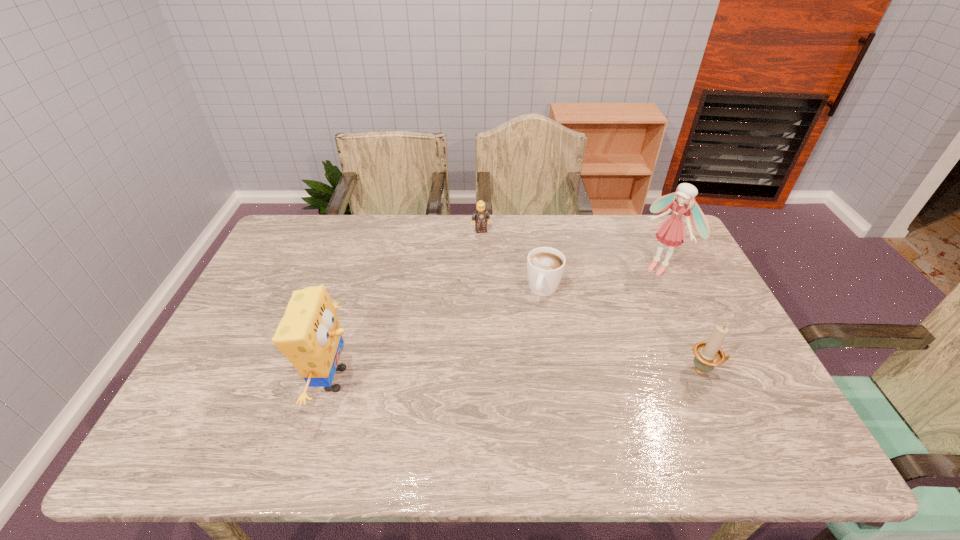
Where is `empty location between the Lego and the candle_holder`? This screenshot has height=540, width=960. empty location between the Lego and the candle_holder is located at coordinates (592, 300).

Locate an element on the screen. Image resolution: width=960 pixels, height=540 pixels. free space between the candle_holder and the sponge is located at coordinates (519, 375).

Find the location of a particular element. The height and width of the screenshot is (540, 960). free space between the fourth object from right to left and the leftmost object is located at coordinates (408, 305).

Locate an element on the screen. unoccupied position between the candle_holder and the sponge is located at coordinates (519, 375).

Locate an element on the screen. The image size is (960, 540). free spot between the doll and the cappuccino is located at coordinates (602, 279).

This screenshot has width=960, height=540. I want to click on vacant region between the fourth object from right to left and the cappuccino, so click(513, 260).

Locate an element on the screen. unoccupied position between the tallest object and the second tallest object is located at coordinates (497, 323).

This screenshot has height=540, width=960. I want to click on vacant space in between the leftmost object and the third shortest object, so click(519, 375).

The image size is (960, 540). Find the location of `object identified as the second closest to the leftmost object`. object identified as the second closest to the leftmost object is located at coordinates (481, 215).

This screenshot has height=540, width=960. Find the location of `object that stands as the closest to the doll`. object that stands as the closest to the doll is located at coordinates (545, 265).